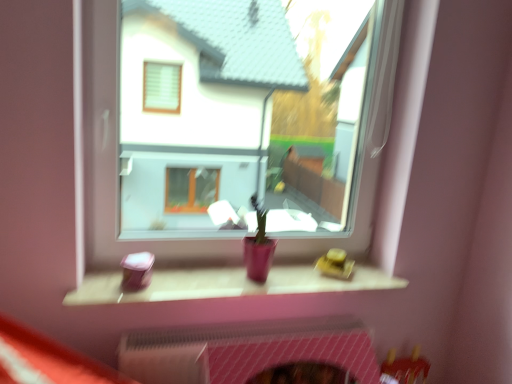
Question: Considering the relative positions of transparent glass window at center and pink mesh fireplace at lower center in the image provided, is transparent glass window at center behind pink mesh fireplace at lower center?

Choices:
 (A) yes
 (B) no

Answer: (B)

Question: Does transparent glass window at center have a larger size compared to pink mesh fireplace at lower center?

Choices:
 (A) no
 (B) yes

Answer: (B)

Question: Is there a large distance between transparent glass window at center and pink mesh fireplace at lower center?

Choices:
 (A) yes
 (B) no

Answer: (A)

Question: From the image's perspective, does transparent glass window at center appear lower than pink mesh fireplace at lower center?

Choices:
 (A) yes
 (B) no

Answer: (B)

Question: Does transparent glass window at center have a smaller size compared to pink mesh fireplace at lower center?

Choices:
 (A) no
 (B) yes

Answer: (A)

Question: Can we say transparent glass window at center lies outside pink mesh fireplace at lower center?

Choices:
 (A) no
 (B) yes

Answer: (B)

Question: Considering the relative sizes of transparent glass window at center and matte pink wood at center in the image provided, is transparent glass window at center taller than matte pink wood at center?

Choices:
 (A) no
 (B) yes

Answer: (B)

Question: Is transparent glass window at center surrounding matte pink wood at center?

Choices:
 (A) no
 (B) yes

Answer: (A)

Question: Could you tell me if transparent glass window at center is facing matte pink wood at center?

Choices:
 (A) yes
 (B) no

Answer: (A)

Question: Is transparent glass window at center next to matte pink wood at center and touching it?

Choices:
 (A) yes
 (B) no

Answer: (B)

Question: Can you confirm if transparent glass window at center is thinner than matte pink wood at center?

Choices:
 (A) no
 (B) yes

Answer: (B)

Question: Is transparent glass window at center behind matte pink wood at center?

Choices:
 (A) no
 (B) yes

Answer: (A)

Question: Is pink mesh fireplace at lower center bigger than matte pink wood at center?

Choices:
 (A) no
 (B) yes

Answer: (B)